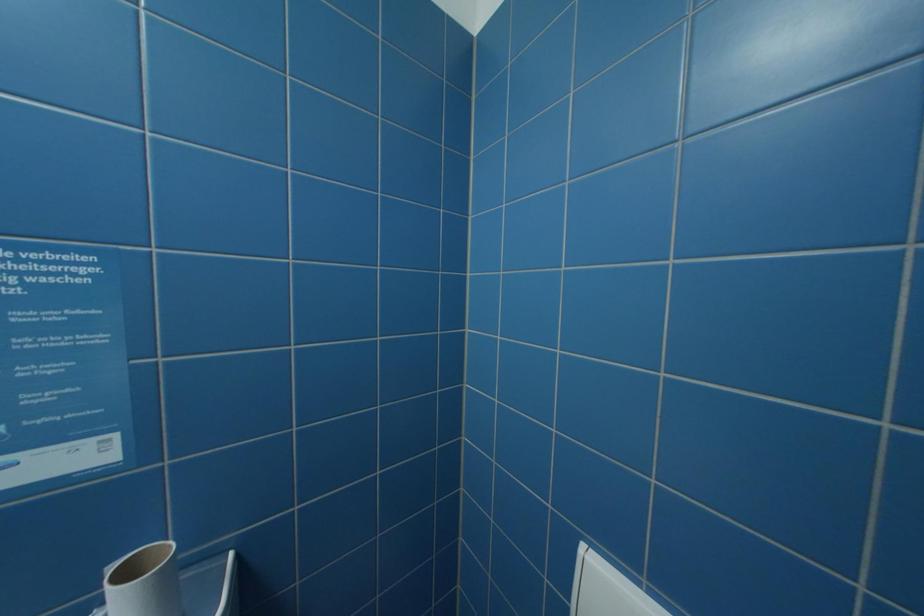
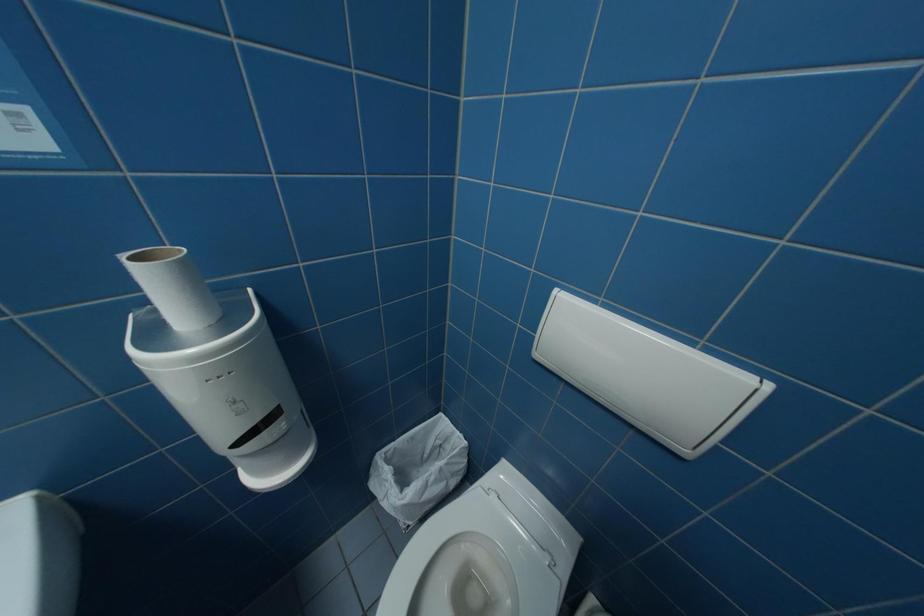
Question: The images are taken continuously from a first-person perspective. In which direction is your viewpoint rotating?

Choices:
 (A) Left
 (B) Right
 (C) Up
 (D) Down

Answer: (D)